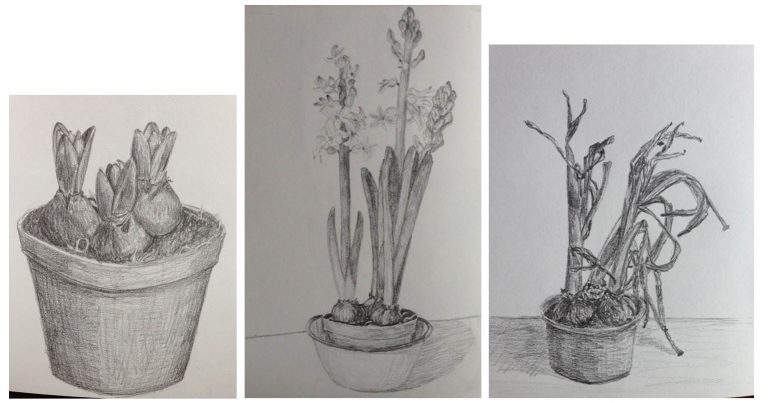
Where is `medium sized plant with wilting leaves`? medium sized plant with wilting leaves is located at coordinates (644, 271), (603, 265), (674, 174).